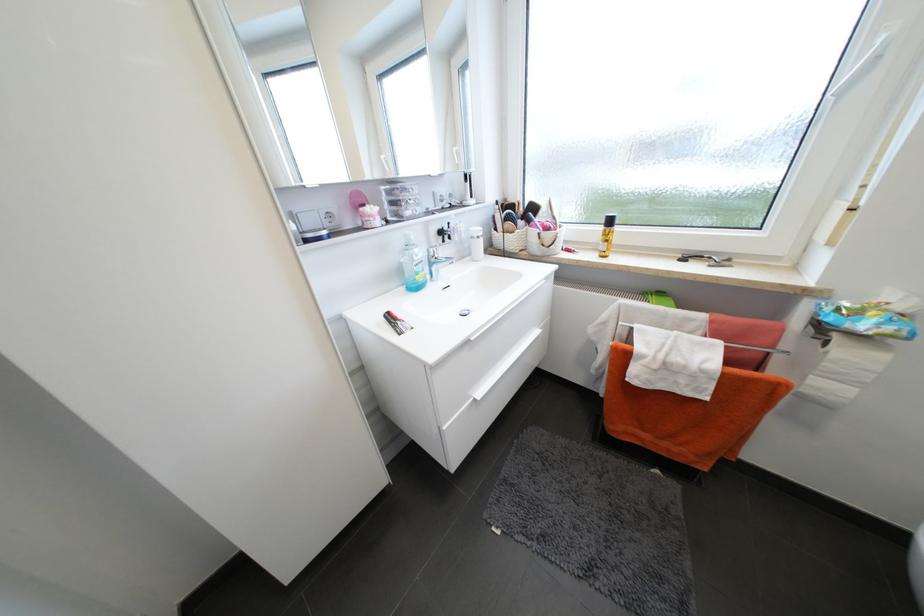
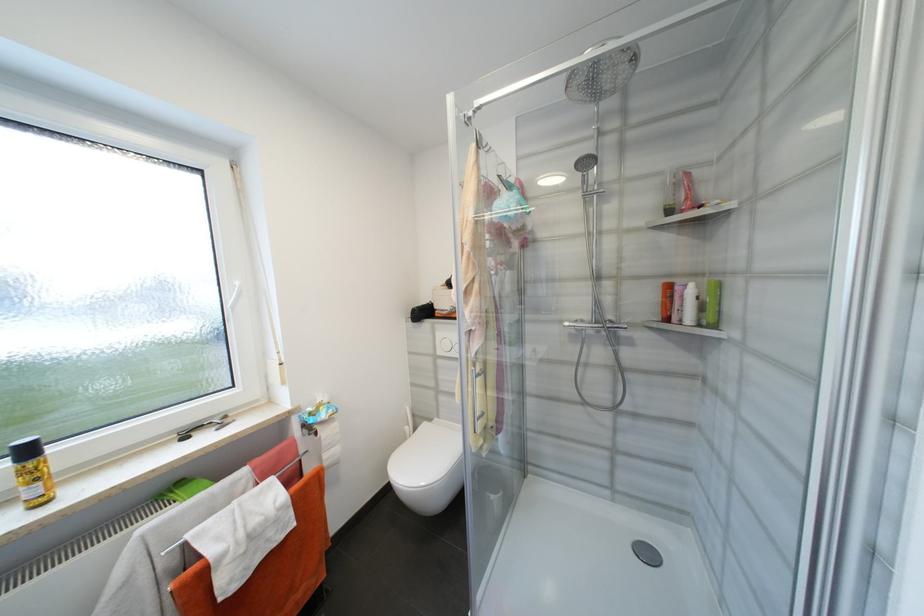
Where in the second image is the point corresponding to point (888, 41) from the first image?

(242, 285)